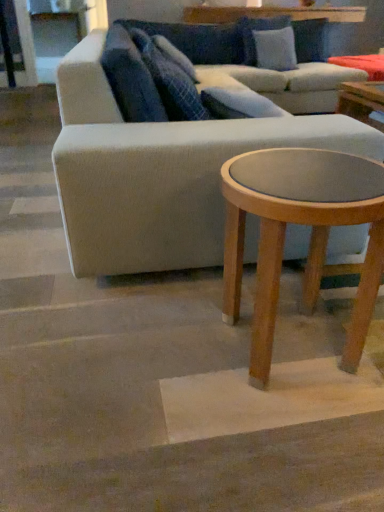
Question: From a real-world perspective, is blue textured pillow at upper center, placed as the second pillow when sorted from front to back, under light gray fabric couch at center?

Choices:
 (A) no
 (B) yes

Answer: (A)

Question: From a real-world perspective, does blue textured pillow at upper center, the second pillow when ordered from back to front, stand above light gray fabric couch at center?

Choices:
 (A) yes
 (B) no

Answer: (A)

Question: Does blue textured pillow at upper center, the second pillow when ordered from back to front, come in front of light gray fabric couch at center?

Choices:
 (A) no
 (B) yes

Answer: (A)

Question: Is blue textured pillow at upper center, acting as the second pillow starting from the right, bigger than light gray fabric couch at center?

Choices:
 (A) no
 (B) yes

Answer: (A)

Question: Is blue textured pillow at upper center, placed as the 3th pillow when sorted from top to bottom, shorter than light gray fabric couch at center?

Choices:
 (A) no
 (B) yes

Answer: (B)

Question: In the image, is blue textured pillow at upper center, the second pillow when ordered from bottom to top, positioned in front of or behind blue textured pillow at upper center, placed as the second pillow when sorted from front to back?

Choices:
 (A) behind
 (B) front

Answer: (B)

Question: From their relative heights in the image, would you say blue textured pillow at upper center, placed as the 1th pillow when sorted from left to right, is taller or shorter than blue textured pillow at upper center, placed as the second pillow when sorted from front to back?

Choices:
 (A) short
 (B) tall

Answer: (B)

Question: From the image's perspective, is blue textured pillow at upper center, marked as the first pillow in a front-to-back arrangement, positioned above or below blue textured pillow at upper center, placed as the 3th pillow when sorted from top to bottom?

Choices:
 (A) above
 (B) below

Answer: (A)

Question: Is blue textured pillow at upper center, arranged as the third pillow when viewed from the right, to the left or to the right of blue textured pillow at upper center, placed as the 3th pillow when sorted from top to bottom, in the image?

Choices:
 (A) left
 (B) right

Answer: (A)

Question: Is light gray fabric couch at center wider or thinner than light brown wood coffee table at lower right?

Choices:
 (A) wide
 (B) thin

Answer: (A)

Question: Is light gray fabric couch at center in front of or behind light brown wood coffee table at lower right in the image?

Choices:
 (A) front
 (B) behind

Answer: (B)

Question: From a real-world perspective, is light gray fabric couch at center above or below light brown wood coffee table at lower right?

Choices:
 (A) below
 (B) above

Answer: (B)

Question: Considering the relative positions of light gray fabric couch at center and light brown wood coffee table at lower right in the image provided, is light gray fabric couch at center to the left or to the right of light brown wood coffee table at lower right?

Choices:
 (A) left
 (B) right

Answer: (B)

Question: In the image, is blue textured pillow at upper center, marked as the first pillow in a front-to-back arrangement, positioned in front of or behind light blue fabric pillow at upper center, the 3th pillow from the left?

Choices:
 (A) behind
 (B) front

Answer: (B)

Question: Considering the relative positions of blue textured pillow at upper center, arranged as the third pillow when viewed from the right, and light blue fabric pillow at upper center, the first pillow when ordered from top to bottom, in the image provided, is blue textured pillow at upper center, arranged as the third pillow when viewed from the right, to the left or to the right of light blue fabric pillow at upper center, the first pillow when ordered from top to bottom,?

Choices:
 (A) left
 (B) right

Answer: (A)